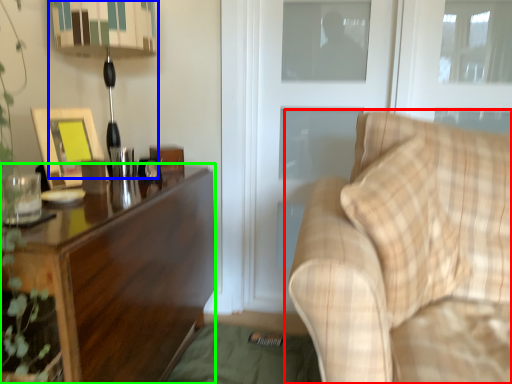
Question: Estimate the real-world distances between objects in this image. Which object is closer to studio couch (highlighted by a red box), table lamp (highlighted by a blue box) or desk (highlighted by a green box)?

Choices:
 (A) table lamp
 (B) desk

Answer: (B)